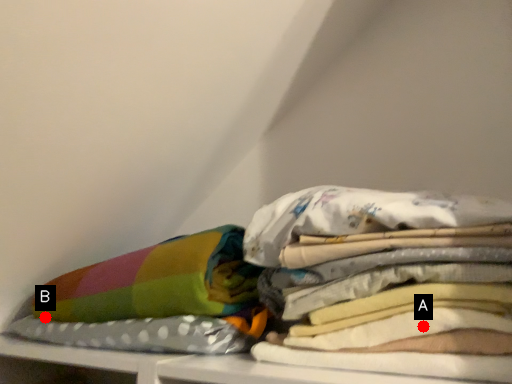
Question: Two points are circled on the image, labeled by A and B beside each circle. Which point is closer to the camera?

Choices:
 (A) A is closer
 (B) B is closer

Answer: (A)